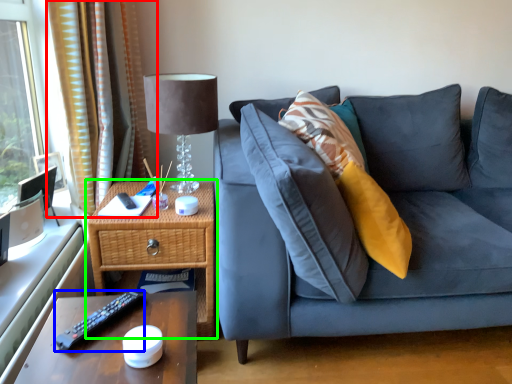
Question: Based on their relative distances, which object is nearer to curtain (highlighted by a red box)? Choose from remote (highlighted by a blue box) and nightstand (highlighted by a green box).

Choices:
 (A) remote
 (B) nightstand

Answer: (B)